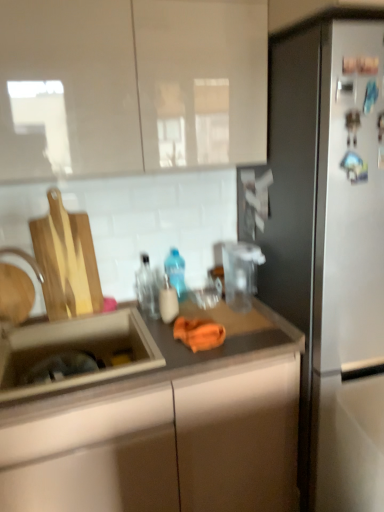
Where is `vacant space in front of transparent glass bottle at center, the second bottle when ordered from back to front`? The image size is (384, 512). vacant space in front of transparent glass bottle at center, the second bottle when ordered from back to front is located at coordinates (148, 322).